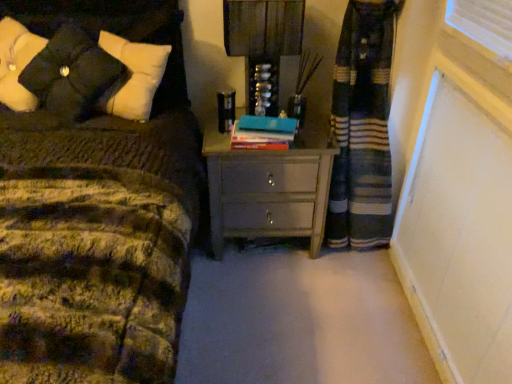
Identify the location of free space in front of matte gray chest of drawers at center. This screenshot has width=512, height=384. (274, 301).